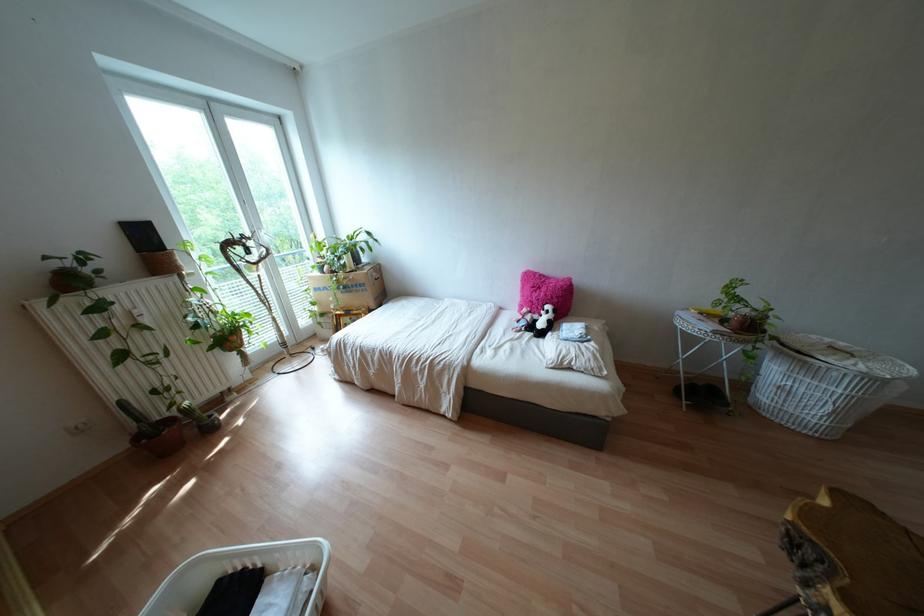
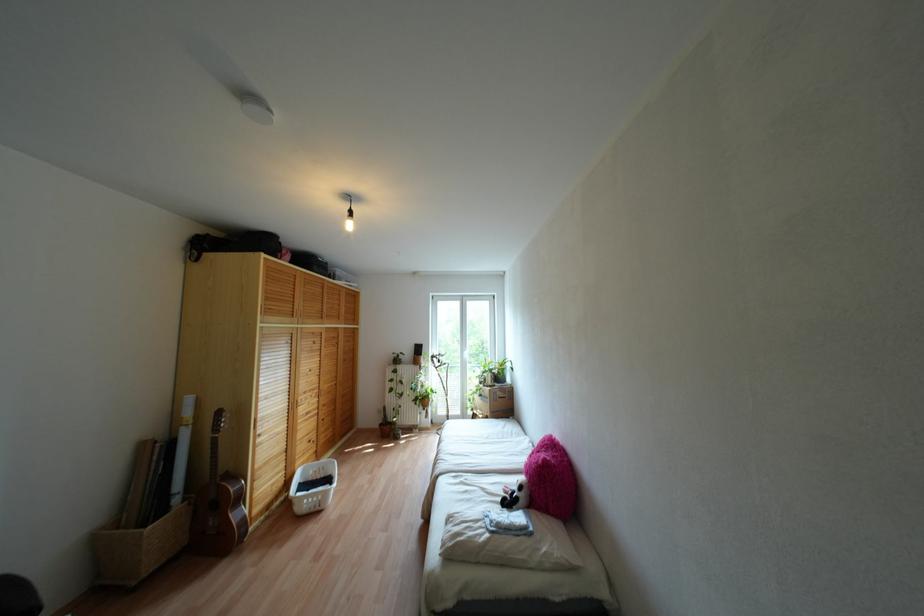
Where in the second image is the point corresponding to pixel 235 314 from the first image?

(431, 389)